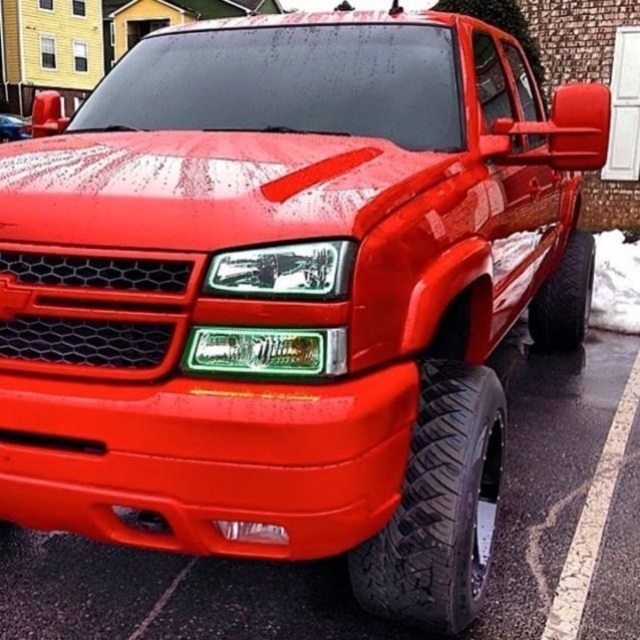
You are a delivery person trying to park your vehicle behind the glossy red truck at center. There is a black rubber tire at lower right blocking the path. Can you drive around it to park behind the truck?

The black rubber tire at lower right is in front of the glossy red truck at center, so you can drive around it to park behind the truck since the tire is blocking the front but not the sides.

You are a mechanic inspecting the tires of the red pickup truck. You notice two black rubber tires on the right side of the vehicle. Which tire has a wider width, the black rubber tire at lower right or the black rubber tire at right?

The black rubber tire at right has a greater width compared to the black rubber tire at lower right.

You are standing in front of the red pickup truck. There is a point marked at coordinates (440, 506). What object does this point correspond to?

The point at coordinates (440, 506) corresponds to the black rubber tire at lower right.